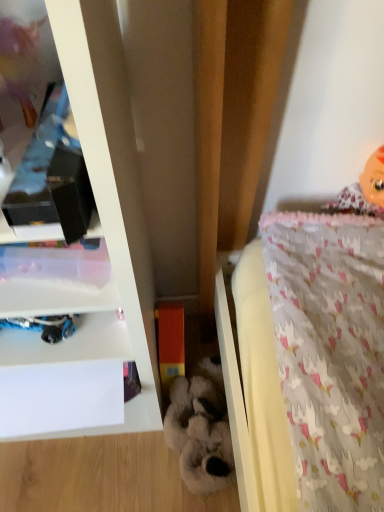
Find the location of `fluffy white stuffed animal at center, which is the first toy from right to left`. fluffy white stuffed animal at center, which is the first toy from right to left is located at coordinates (201, 428).

I want to click on orange matte block at center, which appears as the 1th toy when viewed from the left, so click(x=170, y=340).

This screenshot has height=512, width=384. Find the location of `white glossy shelf at upper left`. white glossy shelf at upper left is located at coordinates (104, 211).

What is the approximate width of white glossy shelf at upper left?

It is 15.51 inches.

Find the location of a particular element. pink fabric doll at upper right is located at coordinates (364, 190).

Identify the location of fluffy white stuffed animal at center, which is the first toy from right to left. (201, 428).

Looking at this image, is pink fabric doll at upper right facing towards white glossy shelf at upper left?

No, pink fabric doll at upper right is not turned towards white glossy shelf at upper left.

From the image's perspective, is pink fabric doll at upper right beneath white glossy shelf at upper left?

No, from the image's perspective, pink fabric doll at upper right is not below white glossy shelf at upper left.

Is pink fabric doll at upper right wider than white glossy shelf at upper left?

In fact, pink fabric doll at upper right might be narrower than white glossy shelf at upper left.

Is pink fabric doll at upper right located outside white glossy shelf at upper left?

Yes, pink fabric doll at upper right is not within white glossy shelf at upper left.

From the image's perspective, would you say fluffy white stuffed animal at center, which ranks as the 2th toy in left-to-right order, is shown under orange matte block at center, which is the 2th toy from right to left?

Yes.

From the picture: Between fluffy white stuffed animal at center, which ranks as the 2th toy in left-to-right order, and orange matte block at center, which appears as the 1th toy when viewed from the left, which one has smaller size?

With smaller size is orange matte block at center, which appears as the 1th toy when viewed from the left.

From a real-world perspective, is fluffy white stuffed animal at center, which is the first toy from right to left, over orange matte block at center, which is the 2th toy from right to left?

Actually, fluffy white stuffed animal at center, which is the first toy from right to left, is physically below orange matte block at center, which is the 2th toy from right to left, in the real world.

Is fluffy white stuffed animal at center, which ranks as the 2th toy in left-to-right order, taller than orange matte block at center, which appears as the 1th toy when viewed from the left?

Incorrect, the height of fluffy white stuffed animal at center, which ranks as the 2th toy in left-to-right order, is not larger of that of orange matte block at center, which appears as the 1th toy when viewed from the left.

Would you say fluffy white stuffed animal at center, which ranks as the 2th toy in left-to-right order, is part of pink fabric doll at upper right's contents?

No, fluffy white stuffed animal at center, which ranks as the 2th toy in left-to-right order, is not surrounded by pink fabric doll at upper right.

The width and height of the screenshot is (384, 512). What are the coordinates of `the 1st toy counting from the left side of the pink fabric doll at upper right` in the screenshot? It's located at (201, 428).

Which of these two, pink fabric doll at upper right or fluffy white stuffed animal at center, which is the first toy from right to left, stands shorter?

fluffy white stuffed animal at center, which is the first toy from right to left.

Identify the location of doll above the orange matte block at center, which is the 2th toy from right to left (from the image's perspective). This screenshot has height=512, width=384. (364, 190).

Who is bigger, pink fabric doll at upper right or orange matte block at center, which is the 2th toy from right to left?

With larger size is pink fabric doll at upper right.

From a real-world perspective, is pink fabric doll at upper right below orange matte block at center, which appears as the 1th toy when viewed from the left?

No.

Considering the positions of objects pink fabric doll at upper right and orange matte block at center, which appears as the 1th toy when viewed from the left, in the image provided, who is in front, pink fabric doll at upper right or orange matte block at center, which appears as the 1th toy when viewed from the left,?

pink fabric doll at upper right is closer to the camera.

I want to click on shelf on the left of orange matte block at center, which is the 2th toy from right to left, so point(104,211).

Does white glossy shelf at upper left contain orange matte block at center, which appears as the 1th toy when viewed from the left?

No.

Can you confirm if white glossy shelf at upper left is smaller than orange matte block at center, which is the 2th toy from right to left?

No.

Does point (139, 318) come behind point (171, 306)?

That is False.

Is fluffy white stuffed animal at center, which ranks as the 2th toy in left-to-right order, positioned with its back to white glossy shelf at upper left?

No.

Is fluffy white stuffed animal at center, which is the first toy from right to left, to the right of white glossy shelf at upper left from the viewer's perspective?

Yes, fluffy white stuffed animal at center, which is the first toy from right to left, is to the right of white glossy shelf at upper left.

From a real-world perspective, is fluffy white stuffed animal at center, which ranks as the 2th toy in left-to-right order, located higher than white glossy shelf at upper left?

No, from a real-world perspective, fluffy white stuffed animal at center, which ranks as the 2th toy in left-to-right order, is not over white glossy shelf at upper left

Looking at this image, how many degrees apart are the facing directions of fluffy white stuffed animal at center, which is the first toy from right to left, and white glossy shelf at upper left?

There is a 40.1-degree angle between the facing directions of fluffy white stuffed animal at center, which is the first toy from right to left, and white glossy shelf at upper left.

Is orange matte block at center, which is the 2th toy from right to left, next to pink fabric doll at upper right and touching it?

No, orange matte block at center, which is the 2th toy from right to left, is not next to pink fabric doll at upper right.

Between orange matte block at center, which is the 2th toy from right to left, and pink fabric doll at upper right, which one appears on the right side from the viewer's perspective?

pink fabric doll at upper right is more to the right.

Considering the relative sizes of orange matte block at center, which is the 2th toy from right to left, and pink fabric doll at upper right in the image provided, is orange matte block at center, which is the 2th toy from right to left, shorter than pink fabric doll at upper right?

Incorrect, the height of orange matte block at center, which is the 2th toy from right to left, does not fall short of that of pink fabric doll at upper right.

Considering the positions of objects orange matte block at center, which is the 2th toy from right to left, and pink fabric doll at upper right in the image provided, who is in front, orange matte block at center, which is the 2th toy from right to left, or pink fabric doll at upper right?

pink fabric doll at upper right.

The height and width of the screenshot is (512, 384). There is a white glossy shelf at upper left. What are the coordinates of `doll above it (from a real-world perspective)` in the screenshot? It's located at (364, 190).

Image resolution: width=384 pixels, height=512 pixels. Find the location of `toy below the orange matte block at center, which is the 2th toy from right to left (from a real-world perspective)`. toy below the orange matte block at center, which is the 2th toy from right to left (from a real-world perspective) is located at coordinates coord(201,428).

Estimate the real-world distances between objects in this image. Which object is further from white glossy shelf at upper left, pink fabric doll at upper right or fluffy white stuffed animal at center, which ranks as the 2th toy in left-to-right order?

Among the two, pink fabric doll at upper right is located further to white glossy shelf at upper left.

Considering their positions, is fluffy white stuffed animal at center, which is the first toy from right to left, positioned further to pink fabric doll at upper right than white glossy shelf at upper left?

fluffy white stuffed animal at center, which is the first toy from right to left, is further to pink fabric doll at upper right.

Looking at the image, which one is located closer to pink fabric doll at upper right, fluffy white stuffed animal at center, which is the first toy from right to left, or orange matte block at center, which appears as the 1th toy when viewed from the left?

Among the two, orange matte block at center, which appears as the 1th toy when viewed from the left, is located nearer to pink fabric doll at upper right.

Looking at the image, which one is located closer to orange matte block at center, which is the 2th toy from right to left, pink fabric doll at upper right or white glossy shelf at upper left?

white glossy shelf at upper left lies closer to orange matte block at center, which is the 2th toy from right to left, than the other object.

Looking at the image, which one is located further to pink fabric doll at upper right, orange matte block at center, which is the 2th toy from right to left, or white glossy shelf at upper left?

white glossy shelf at upper left is further to pink fabric doll at upper right.

Which object lies nearer to the anchor point pink fabric doll at upper right, white glossy shelf at upper left or orange matte block at center, which appears as the 1th toy when viewed from the left?

orange matte block at center, which appears as the 1th toy when viewed from the left.

From the image, which object appears to be nearer to fluffy white stuffed animal at center, which is the first toy from right to left, white glossy shelf at upper left or pink fabric doll at upper right?

white glossy shelf at upper left lies closer to fluffy white stuffed animal at center, which is the first toy from right to left, than the other object.

Based on their spatial positions, is orange matte block at center, which appears as the 1th toy when viewed from the left, or pink fabric doll at upper right further from white glossy shelf at upper left?

The object further to white glossy shelf at upper left is pink fabric doll at upper right.

Image resolution: width=384 pixels, height=512 pixels. Find the location of `toy between white glossy shelf at upper left and orange matte block at center, which appears as the 1th toy when viewed from the left, from front to back`. toy between white glossy shelf at upper left and orange matte block at center, which appears as the 1th toy when viewed from the left, from front to back is located at coordinates (201, 428).

You are a GUI agent. You are given a task and a screenshot of the screen. Output one action in this format:
    pyautogui.click(x=<x>, y=<y>)
    Task: Click on the toy that lies between pink fabric doll at upper right and fluffy white stuffed animal at center, which is the first toy from right to left, from top to bottom
    This screenshot has height=512, width=384.
    Given the screenshot: What is the action you would take?
    pyautogui.click(x=170, y=340)